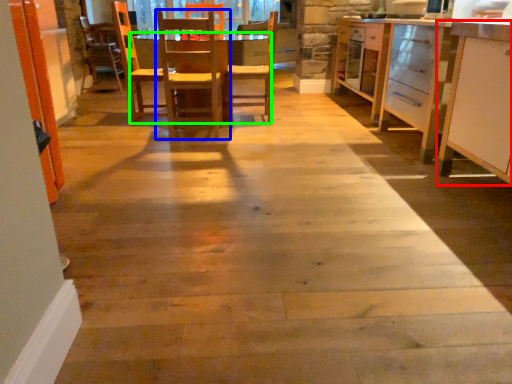
Question: Which object is the closest to the cabinetry (highlighted by a red box)? Choose among these: chair (highlighted by a blue box) or table (highlighted by a green box).

Choices:
 (A) chair
 (B) table

Answer: (A)